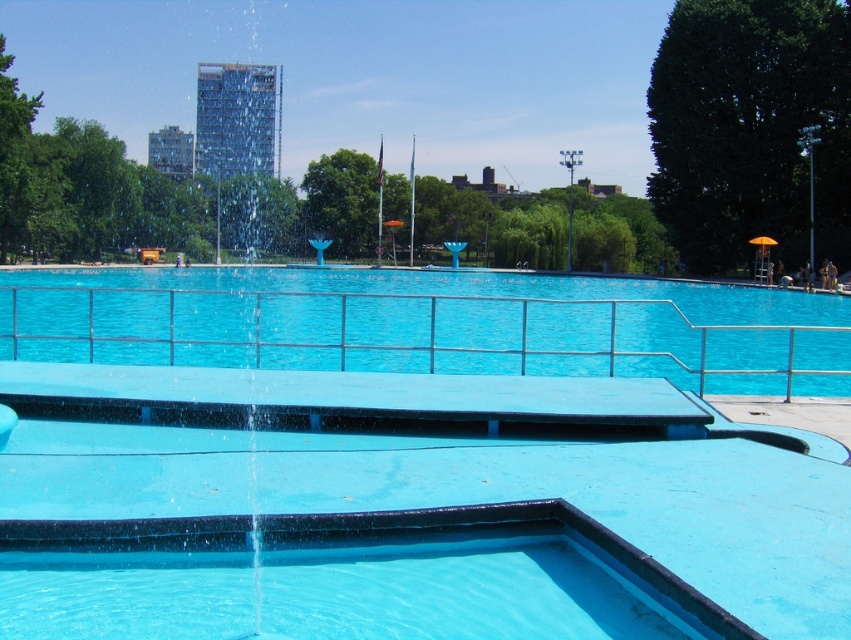
You are standing at the edge of the park and see both the smooth blue pool at center and the blue rubber pool at center. Which one is positioned to the right side?

The smooth blue pool at center is positioned to the right of the blue rubber pool at center.

You are standing at the edge of the scene and want to jump into the water. Which pool should you choose if you prefer a deeper area? The smooth blue pool at center or the blue rubber pool at center?

The smooth blue pool at center is in front of the blue rubber pool at center, so the blue rubber pool at center is further back and likely deeper. Choose the blue rubber pool at center for a deeper area.